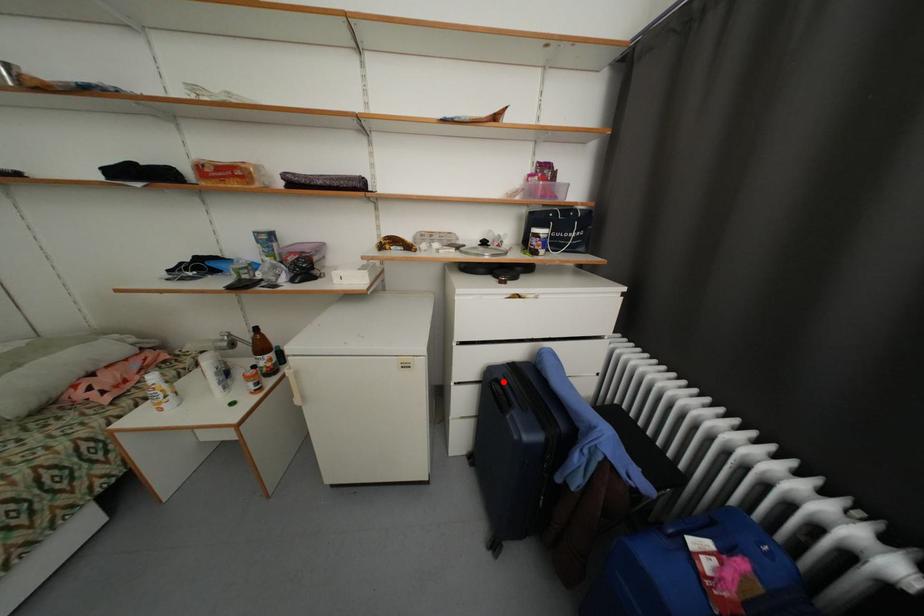
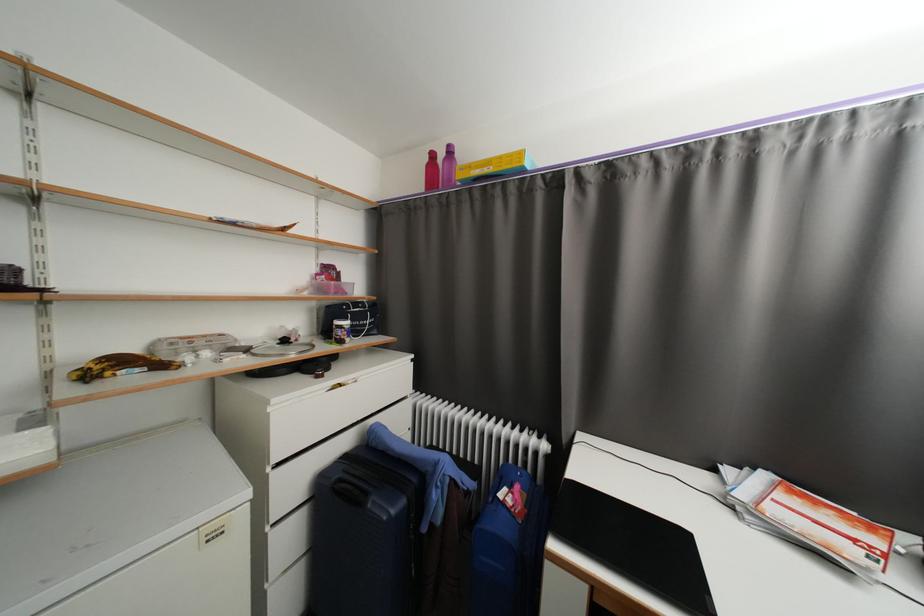
Find the pixel in the second image that matches the highlighted location in the first image.

(346, 482)